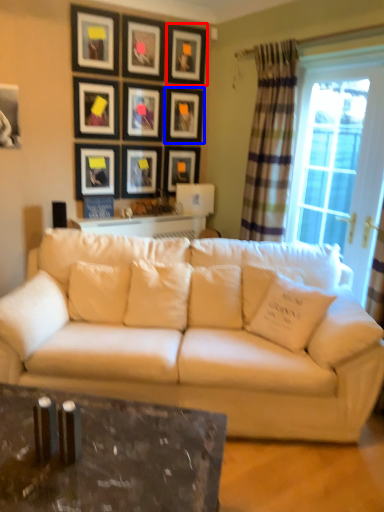
Question: Which of the following is the farthest to the observer, picture frame (highlighted by a red box) or picture frame (highlighted by a blue box)?

Choices:
 (A) picture frame
 (B) picture frame

Answer: (B)